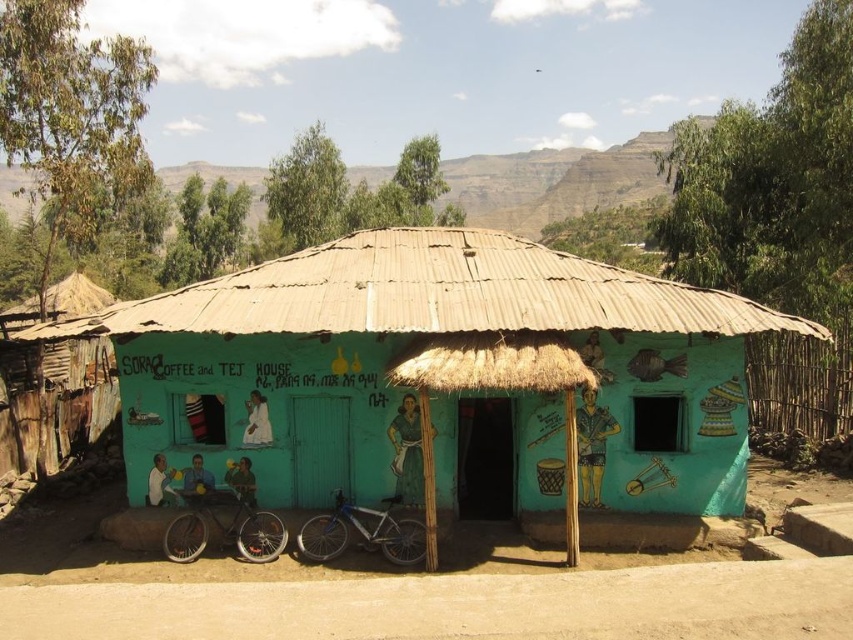
You are standing in front of the turquoise building and want to touch both the brown thatch roof at center and the silver metallic bicycle at center. Which object should you reach for first?

→ You should reach for the brown thatch roof at center first because it is closer to you than the silver metallic bicycle at center.

You are a delivery person who needs to park your 2.5 meter long delivery van between the brown sandy dirt at lower center and the silver metallic bicycle at center. Is there enough space for your van?

The distance between the brown sandy dirt at lower center and the silver metallic bicycle at center is 4.46 meters. Since the van is 2.5 meters long, there is sufficient space to park it between them as 4.46 meters is greater than 2.5 meters.

You are standing in front of the Sora Coffee and Tej House. Where is the brown thatch roof at center located in relation to the two bicycles parked in front of the building?

The brown thatch roof at center is located at point [433,292], which is the central area of the image, so it is positioned behind the two bicycles parked in front of the building.